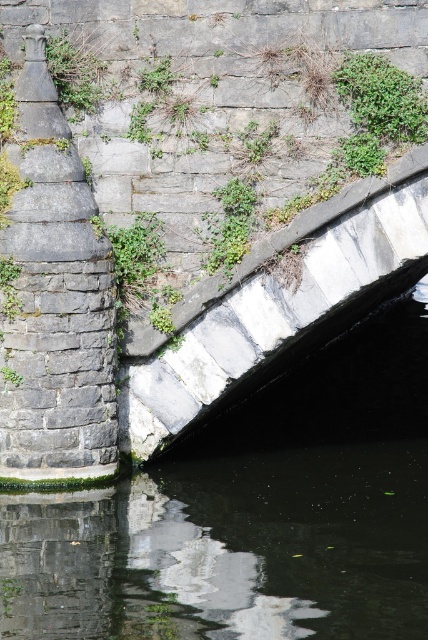
Question: Among these points, which one is farthest from the camera?

Choices:
 (A) (282, 355)
 (B) (332, 480)

Answer: (A)

Question: Is black stone river at lower left wider than stone bridge at center?

Choices:
 (A) no
 (B) yes

Answer: (B)

Question: Which of the following is the closest to the observer?

Choices:
 (A) black stone river at lower left
 (B) stone bridge at center
 (C) green leafy plant at upper center

Answer: (A)

Question: Which point appears farthest from the camera in this image?

Choices:
 (A) (356, 61)
 (B) (279, 294)
 (C) (354, 544)

Answer: (B)

Question: Can you confirm if black stone river at lower left is wider than stone bridge at center?

Choices:
 (A) no
 (B) yes

Answer: (B)

Question: Is black stone river at lower left further to camera compared to green leafy plant at upper center?

Choices:
 (A) yes
 (B) no

Answer: (B)